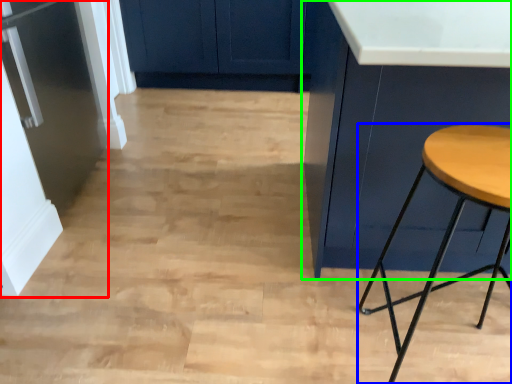
Question: Which is nearer to the fridge (highlighted by a red box)? stool (highlighted by a blue box) or cabinetry (highlighted by a green box).

Choices:
 (A) stool
 (B) cabinetry

Answer: (B)